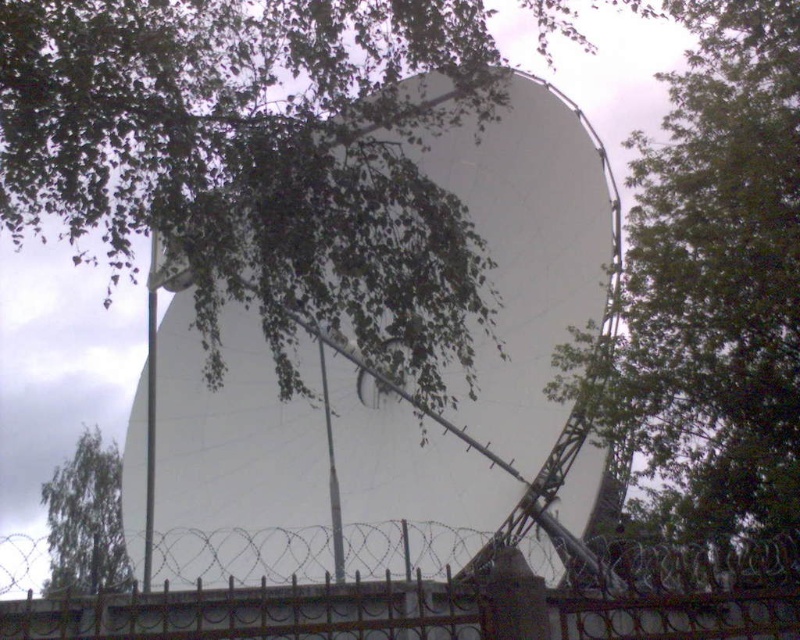
Question: Does green leafy tree at upper right appear on the right side of green leafy tree at upper left?

Choices:
 (A) no
 (B) yes

Answer: (B)

Question: Is white matte satellite at center wider than green leafy tree at upper right?

Choices:
 (A) no
 (B) yes

Answer: (A)

Question: Which point is farther to the camera?

Choices:
 (A) (664, 576)
 (B) (324, 506)

Answer: (B)

Question: Which of the following is the farthest from the observer?

Choices:
 (A) (576, 300)
 (B) (778, 556)

Answer: (B)

Question: Is white matte satellite at center smaller than green leafy tree at upper left?

Choices:
 (A) yes
 (B) no

Answer: (A)

Question: Which is nearer to the black wrought iron fence at center?

Choices:
 (A) green leafy tree at upper left
 (B) green leafy tree at upper right
 (C) white matte satellite at center

Answer: (B)